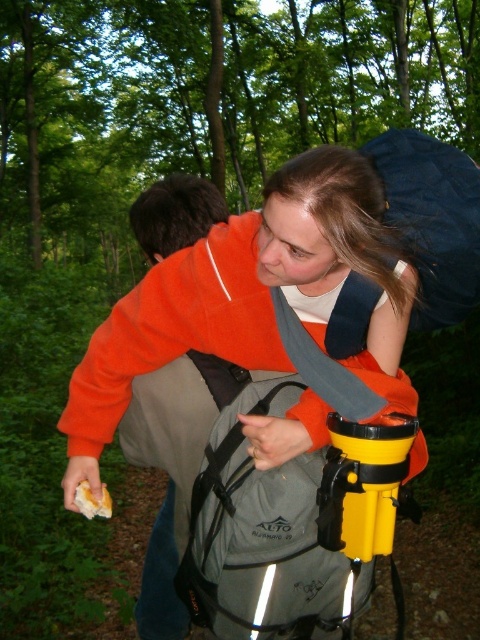
Between orange fleece jacket at center and orange fleece jacket at upper left, which one is positioned lower?

orange fleece jacket at upper left

Which is in front, point (268, 419) or point (188, 484)?

Point (268, 419) is more forward.

Find the location of `orange fleece jacket at center`. orange fleece jacket at center is located at coordinates (252, 298).

Does orange fleece jacket at upper left appear under yellow matte bread at lower left?

Correct, orange fleece jacket at upper left is located below yellow matte bread at lower left.

Who is more distant from viewer, (159, 404) or (81, 490)?

The point (159, 404) is behind.

I want to click on orange fleece jacket at upper left, so click(x=168, y=484).

Which is above, orange fleece jacket at center or navy blue fabric backpack at upper right?

navy blue fabric backpack at upper right

Is orange fleece jacket at center below navy blue fabric backpack at upper right?

Yes.

Does point (206, 269) come farther from viewer compared to point (445, 300)?

No, it is in front of (445, 300).

Locate an element on the screen. This screenshot has width=480, height=640. orange fleece jacket at center is located at coordinates (252, 298).